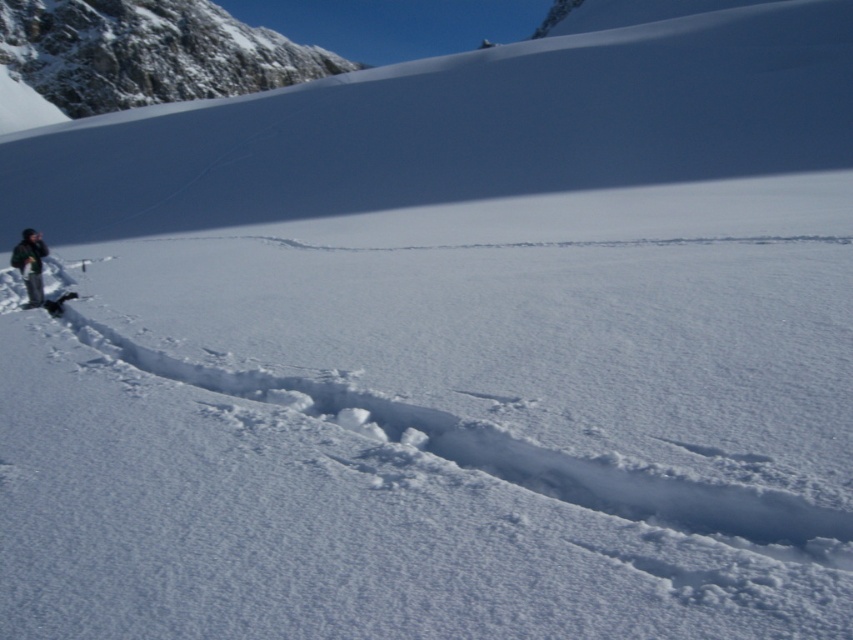
Does black fabric jacket at left appear on the right side of black matte ski at left?

In fact, black fabric jacket at left is to the left of black matte ski at left.

Is black fabric jacket at left positioned before black matte ski at left?

No, it is behind black matte ski at left.

Does point (30, 291) come in front of point (73, 296)?

No, it is not.

At what (x,y) coordinates should I click in order to perform the action: click on black fabric jacket at left. Please return your answer as a coordinate pair (x, y). Looking at the image, I should click on (30, 264).